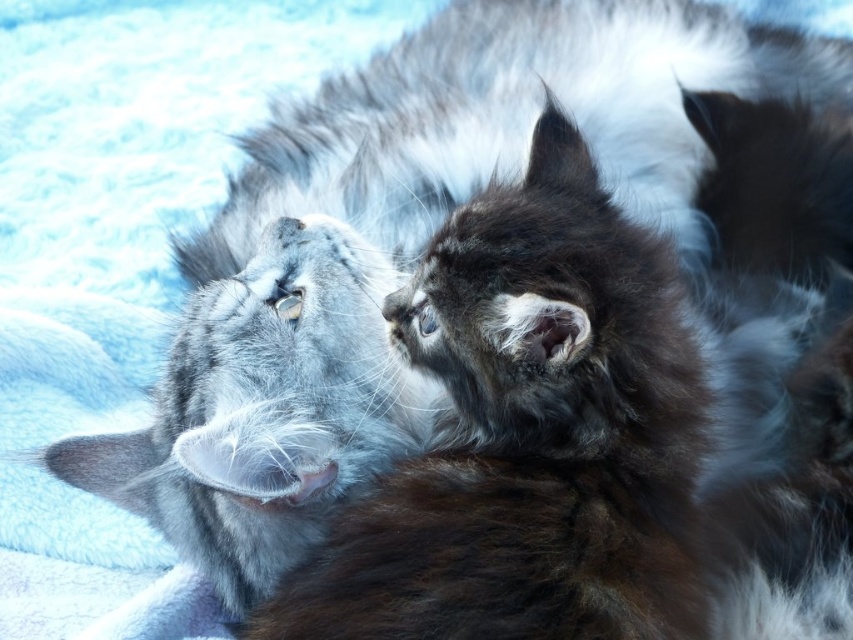
I want to click on fluffy gray cat at center, so click(529, 435).

Is point (595, 563) positioned behind point (828, 328)?

No, it is not.

Is point (508, 625) behind point (718, 125)?

No, it is not.

Where is `fluffy gray cat at center`? This screenshot has width=853, height=640. fluffy gray cat at center is located at coordinates (529, 435).

Locate an element on the screen. soft fur cat at upper left is located at coordinates (265, 408).

Between soft fur cat at upper left and fluffy brown fur at right, which one is positioned lower?

soft fur cat at upper left

Which is behind, point (250, 508) or point (741, 586)?

The point (250, 508) is behind.

Image resolution: width=853 pixels, height=640 pixels. Identify the location of soft fur cat at upper left. (265, 408).

Is point (666, 381) positioned after point (219, 564)?

No, (666, 381) is closer to viewer.

Between fluffy gray cat at center and soft fur cat at upper left, which one appears on the left side from the viewer's perspective?

From the viewer's perspective, soft fur cat at upper left appears more on the left side.

Does point (572, 452) lie in front of point (323, 330)?

Yes, it is in front of point (323, 330).

Where is `fluffy gray cat at center`? The height and width of the screenshot is (640, 853). fluffy gray cat at center is located at coordinates (529, 435).